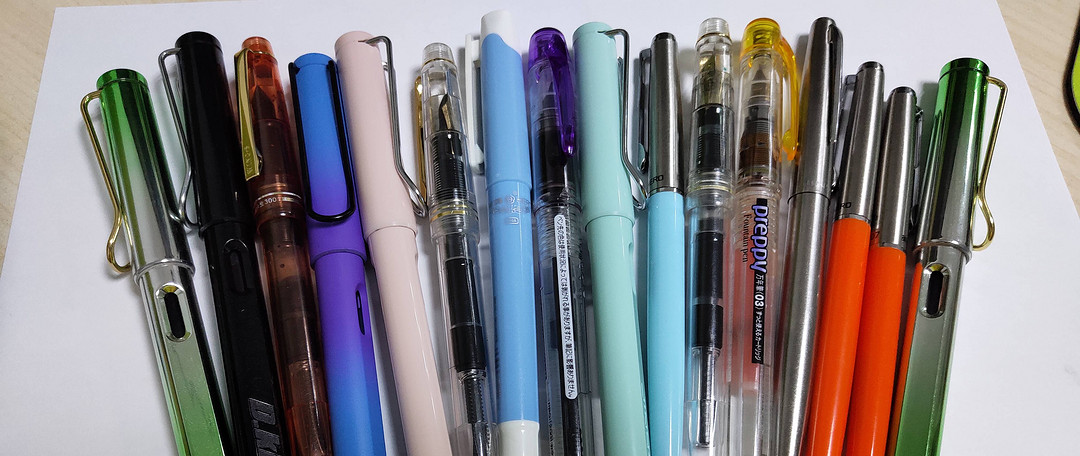
At what (x,y) coordinates should I click in order to perform the action: click on metal pen cases. Please return your answer as a coordinate pair (x, y). This screenshot has width=1080, height=456. Looking at the image, I should click on (956, 199), (821, 158), (862, 171), (902, 185), (662, 155), (150, 245).